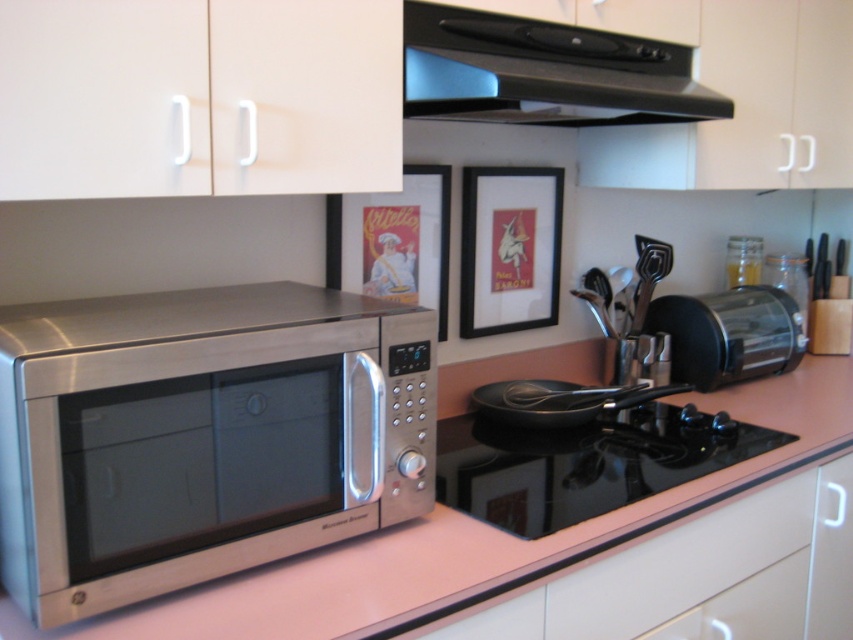
Question: Is metallic poster at upper center positioned in front of satin silver toaster at right?

Choices:
 (A) yes
 (B) no

Answer: (A)

Question: Among these points, which one is farthest from the camera?

Choices:
 (A) (258, 419)
 (B) (502, 224)

Answer: (B)

Question: Which object is closer to the camera taking this photo?

Choices:
 (A) satin finish countertop at center
 (B) black matte picture frame at upper center
 (C) metallic poster at upper center

Answer: (A)

Question: Can you confirm if satin finish countertop at center is positioned to the right of satin silver toaster at right?

Choices:
 (A) yes
 (B) no

Answer: (B)

Question: Is the position of stainless steel microwave at lower left less distant than that of satin finish countertop at center?

Choices:
 (A) no
 (B) yes

Answer: (B)

Question: Which point is farther to the camera?

Choices:
 (A) metallic poster at upper center
 (B) black matte exhaust hood at upper center
 (C) black matte picture frame at upper center
 (D) satin silver toaster at right

Answer: (D)